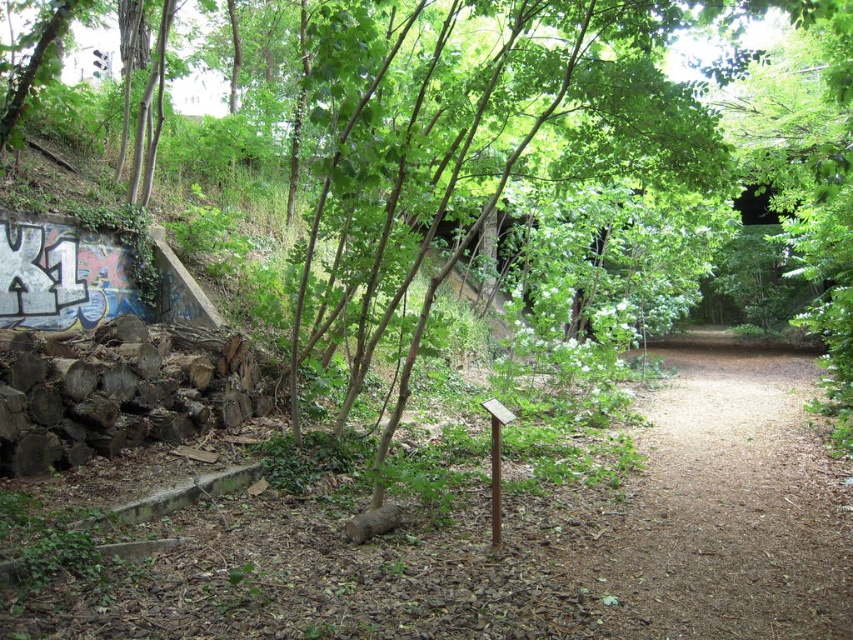
Between brown dirt path at center and green leafy tree at center, which one is positioned lower?

brown dirt path at center

Is point (735, 570) positioned after point (431, 296)?

That is False.

At what (x,y) coordinates should I click in order to perform the action: click on brown dirt path at center. Please return your answer as a coordinate pair (x, y). The image size is (853, 640). Looking at the image, I should click on pos(727,508).